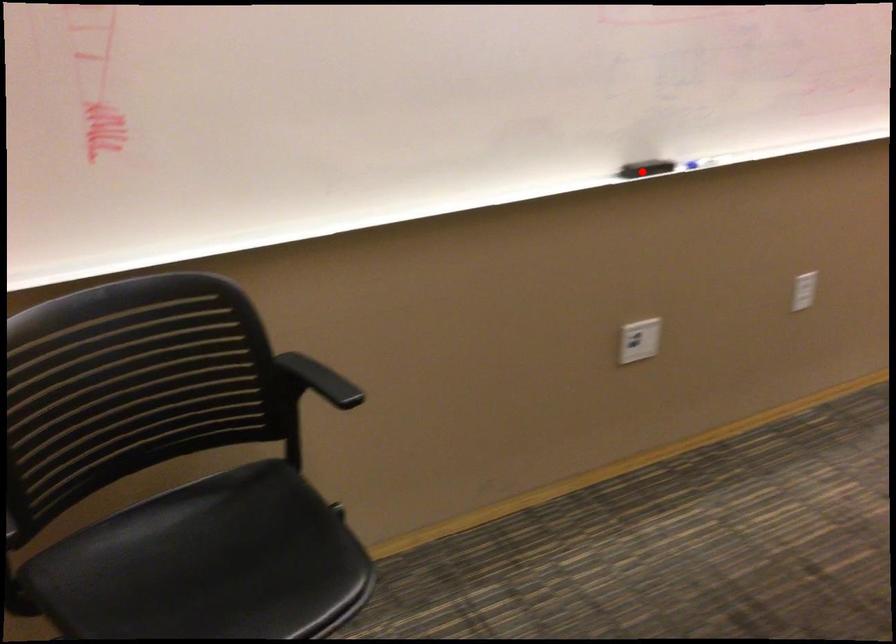
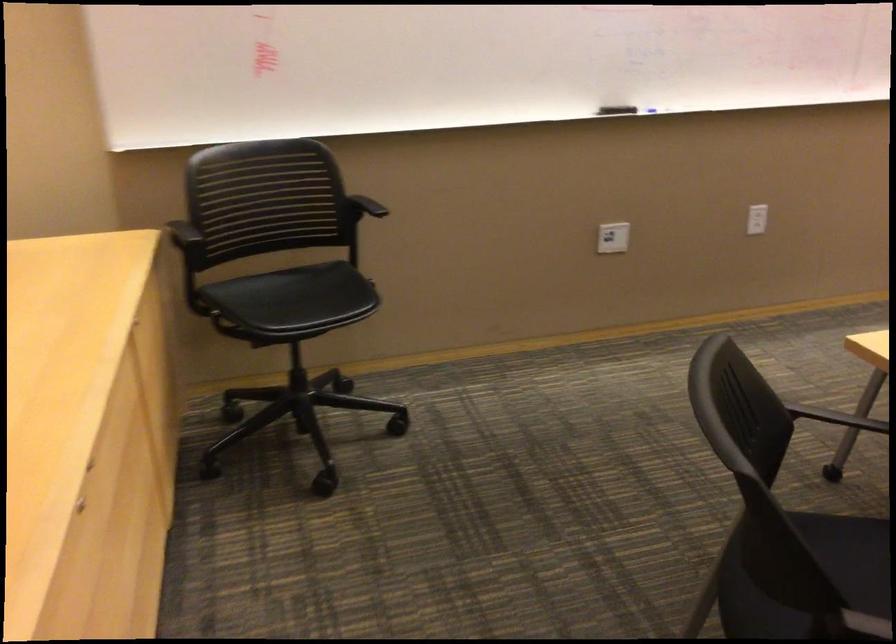
Question: I am providing you with two images of the same scene from different viewpoints. In image1, a red point is highlighted. Considering the same 3D point in image2, which of the following is correct?

Choices:
 (A) It is closer
 (B) It is farther

Answer: (B)